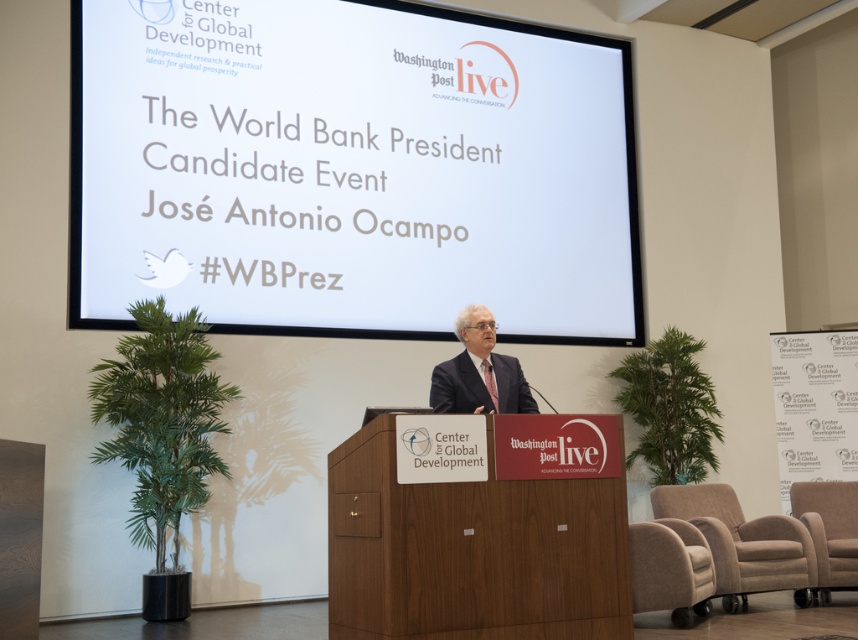
Question: Which of the following is the closest to the observer?

Choices:
 (A) dark suit at center
 (B) dark brown leather armchair at lower right
 (C) white matte projection screen at upper center

Answer: (A)

Question: Observing the image, what is the correct spatial positioning of beige fabric armchair at lower right in reference to dark suit at center?

Choices:
 (A) above
 (B) below

Answer: (B)

Question: Is beige fabric armchair at lower right closer to camera compared to dark brown leather armchair at lower right?

Choices:
 (A) yes
 (B) no

Answer: (A)

Question: Which object is positioned farthest from the dark suit at center?

Choices:
 (A) dark brown leather armchair at lower right
 (B) brown fabric armchair at lower right

Answer: (A)

Question: Which object is the farthest from the white matte projection screen at upper center?

Choices:
 (A) dark brown leather armchair at lower right
 (B) dark suit at center

Answer: (A)

Question: Is brown fabric armchair at lower right bigger than dark brown leather armchair at lower right?

Choices:
 (A) yes
 (B) no

Answer: (A)